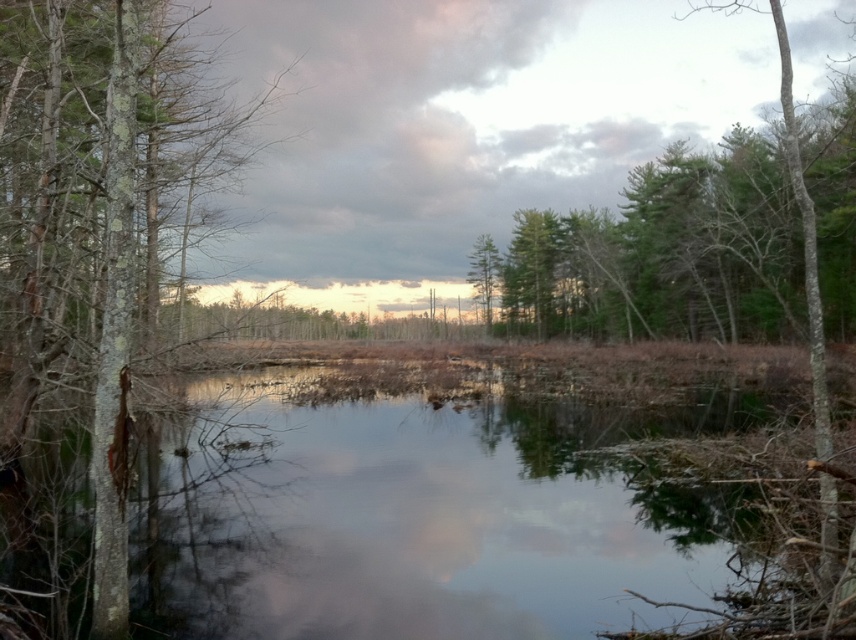
You are standing at the edge of the water and want to determine which tree is taller between the green textured tree at upper center and the green leafy tree at center. Based on the scene, which one is taller?

The green textured tree at upper center is much taller than the green leafy tree at center.

You are an environmental scientist assessing the forest structure. You observe the green textured tree at upper center and the green leafy tree at center. Which tree has a larger width according to the scene?

The green textured tree at upper center has a larger width than the green leafy tree at center, as stated in the description that its width surpasses the latter.